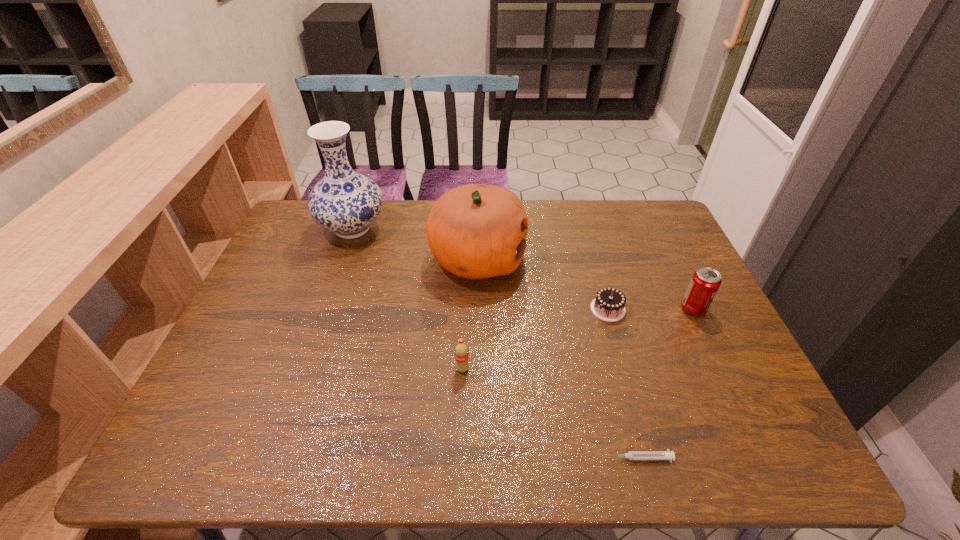
The width and height of the screenshot is (960, 540). Find the location of `the tallest object`. the tallest object is located at coordinates (345, 202).

Locate an element on the screen. The height and width of the screenshot is (540, 960). vase is located at coordinates (345, 202).

Identify the location of pumpkin. The width and height of the screenshot is (960, 540). (476, 231).

The image size is (960, 540). Identify the location of the right soda. (705, 282).

Find the location of `the farther soda`. the farther soda is located at coordinates (705, 282).

Identify the location of the second nearest object. The width and height of the screenshot is (960, 540). (x=461, y=350).

Locate an element on the screen. The width and height of the screenshot is (960, 540). the shorter soda is located at coordinates (461, 350).

You are a GUI agent. You are given a task and a screenshot of the screen. Output one action in this format:
    pyautogui.click(x=<x>, y=<y>)
    Task: Click on the second shortest object
    This screenshot has height=540, width=960.
    Given the screenshot: What is the action you would take?
    pyautogui.click(x=609, y=305)

Where is `the nearest object`? Image resolution: width=960 pixels, height=540 pixels. the nearest object is located at coordinates (631, 455).

Locate an element on the screen. This screenshot has width=960, height=540. syringe is located at coordinates (631, 455).